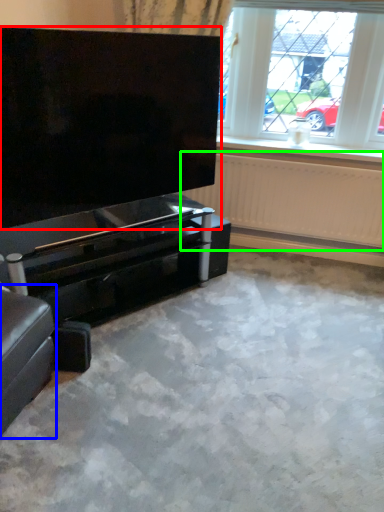
Question: Based on their relative distances, which object is nearer to screen (highlighted by a red box)? Choose from furniture (highlighted by a blue box) and radiator (highlighted by a green box).

Choices:
 (A) furniture
 (B) radiator

Answer: (A)